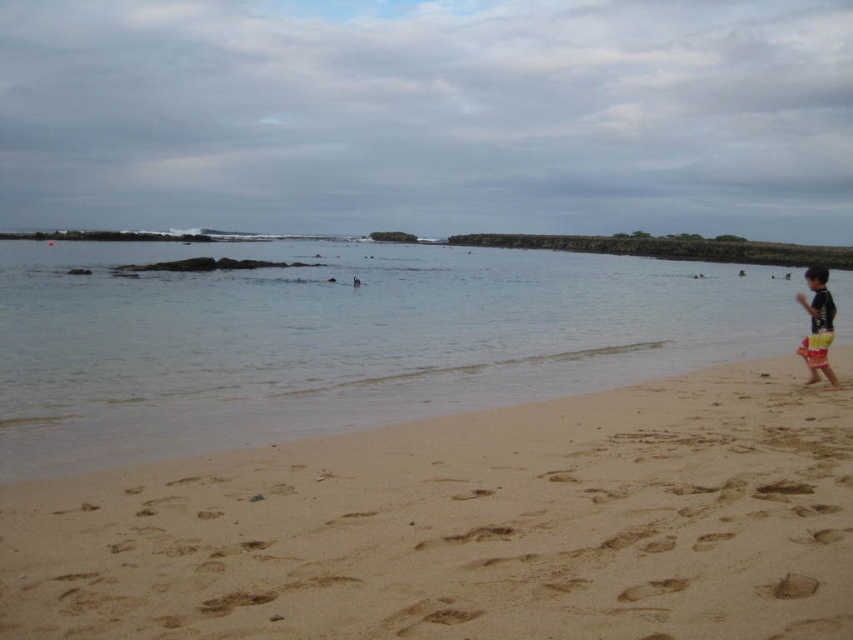
You are a photographer trying to capture the entire scene of the light brown sandy beach at lower right and the black matte swimsuit at right in one shot. Based on their sizes, which object should you focus on to ensure both are visible without zooming in too much?

The light brown sandy beach at lower right has a smaller size compared to the black matte swimsuit at right. To capture both in one shot without zooming in too much, focus on the black matte swimsuit at right since it is larger and will remain visible even at a wider angle.